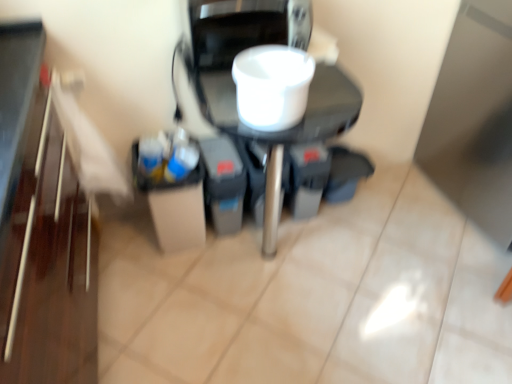
Question: In which direction should I rotate to look at white matte cup at center, positioned as the 2th appliance in back-to-front order?

Choices:
 (A) left
 (B) right

Answer: (B)

Question: In which direction should I rotate to look at white glossy coffee maker at center, which is the 1th appliance from back to front?

Choices:
 (A) right
 (B) left

Answer: (A)

Question: Can you confirm if white matte cup at center, positioned as the 2th appliance in back-to-front order, is shorter than white glossy coffee maker at center, which is the 1th appliance from back to front?

Choices:
 (A) yes
 (B) no

Answer: (A)

Question: Does white matte cup at center, positioned as the 2th appliance in back-to-front order, have a greater width compared to white glossy coffee maker at center, which is the 1th appliance from back to front?

Choices:
 (A) no
 (B) yes

Answer: (A)

Question: Can you see white matte cup at center, the first appliance viewed from the front, touching white glossy coffee maker at center, which is the 1th appliance from back to front?

Choices:
 (A) yes
 (B) no

Answer: (A)

Question: Considering the relative positions of white matte cup at center, positioned as the 2th appliance in back-to-front order, and white glossy coffee maker at center, which is the 1th appliance from back to front, in the image provided, is white matte cup at center, positioned as the 2th appliance in back-to-front order, in front of white glossy coffee maker at center, which is the 1th appliance from back to front,?

Choices:
 (A) no
 (B) yes

Answer: (B)

Question: Is white matte cup at center, positioned as the 2th appliance in back-to-front order, outside of white glossy coffee maker at center, which is the 1th appliance from back to front?

Choices:
 (A) yes
 (B) no

Answer: (A)

Question: Is white glossy coffee maker at center, which is counted as the 2th appliance, starting from the front, located within white matte cup at center, the first appliance viewed from the front?

Choices:
 (A) no
 (B) yes

Answer: (A)

Question: Is white glossy coffee maker at center, which is counted as the 2th appliance, starting from the front, thinner than white matte cup at center, the first appliance viewed from the front?

Choices:
 (A) no
 (B) yes

Answer: (A)

Question: Is white glossy coffee maker at center, which is counted as the 2th appliance, starting from the front, next to white matte cup at center, the first appliance viewed from the front, and touching it?

Choices:
 (A) yes
 (B) no

Answer: (A)

Question: Considering the relative sizes of white glossy coffee maker at center, which is the 1th appliance from back to front, and white matte cup at center, the first appliance viewed from the front, in the image provided, is white glossy coffee maker at center, which is the 1th appliance from back to front, taller than white matte cup at center, the first appliance viewed from the front,?

Choices:
 (A) yes
 (B) no

Answer: (A)

Question: Does white glossy coffee maker at center, which is counted as the 2th appliance, starting from the front, appear on the right side of white matte cup at center, the first appliance viewed from the front?

Choices:
 (A) no
 (B) yes

Answer: (A)

Question: Is white glossy coffee maker at center, which is counted as the 2th appliance, starting from the front, oriented away from white matte cup at center, positioned as the 2th appliance in back-to-front order?

Choices:
 (A) no
 (B) yes

Answer: (A)

Question: Is white glossy coffee maker at center, which is the 1th appliance from back to front, at the left side of white matte cup at center, positioned as the 2th appliance in back-to-front order?

Choices:
 (A) no
 (B) yes

Answer: (B)

Question: Is white glossy coffee maker at center, which is counted as the 2th appliance, starting from the front, spatially inside white matte cup at center, positioned as the 2th appliance in back-to-front order, or outside of it?

Choices:
 (A) outside
 (B) inside

Answer: (A)